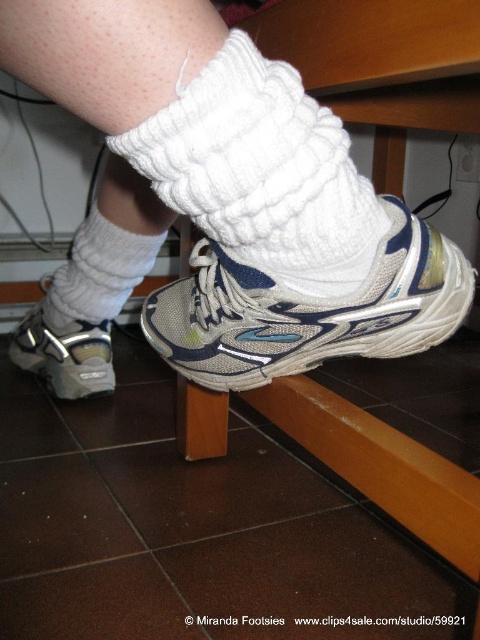
You are a GUI agent. You are given a task and a screenshot of the screen. Output one action in this format:
    pyautogui.click(x=<x>, y=<y>)
    Task: Click on the white knitted sock at center
    
    Given the screenshot: What is the action you would take?
    pyautogui.click(x=262, y=173)

Is white knitted sock at center bigger than white knitted sock at lower center?

No.

Between point (227, 164) and point (83, 312), which one is positioned behind?

The point (83, 312) is more distant.

Identify the location of white knitted sock at center. Image resolution: width=480 pixels, height=640 pixels. (262, 173).

Between white knitted socks at center and white knitted sock at lower center, which one appears on the left side from the viewer's perspective?

Positioned to the left is white knitted sock at lower center.

What do you see at coordinates (218, 208) in the screenshot? The image size is (480, 640). I see `white knitted socks at center` at bounding box center [218, 208].

At what (x,y) coordinates should I click in order to perform the action: click on white knitted socks at center. Please return your answer as a coordinate pair (x, y). Looking at the image, I should click on (218, 208).

Is white knitted sock at center taller than gray mesh running shoe at lower left?

Correct, white knitted sock at center is much taller as gray mesh running shoe at lower left.

Who is lower down, white knitted sock at center or gray mesh running shoe at lower left?

gray mesh running shoe at lower left is lower down.

Who is more forward, (266, 212) or (31, 328)?

Point (266, 212) is more forward.

At what (x,y) coordinates should I click in order to perform the action: click on white knitted sock at center. Please return your answer as a coordinate pair (x, y). This screenshot has width=480, height=640. Looking at the image, I should click on (262, 173).